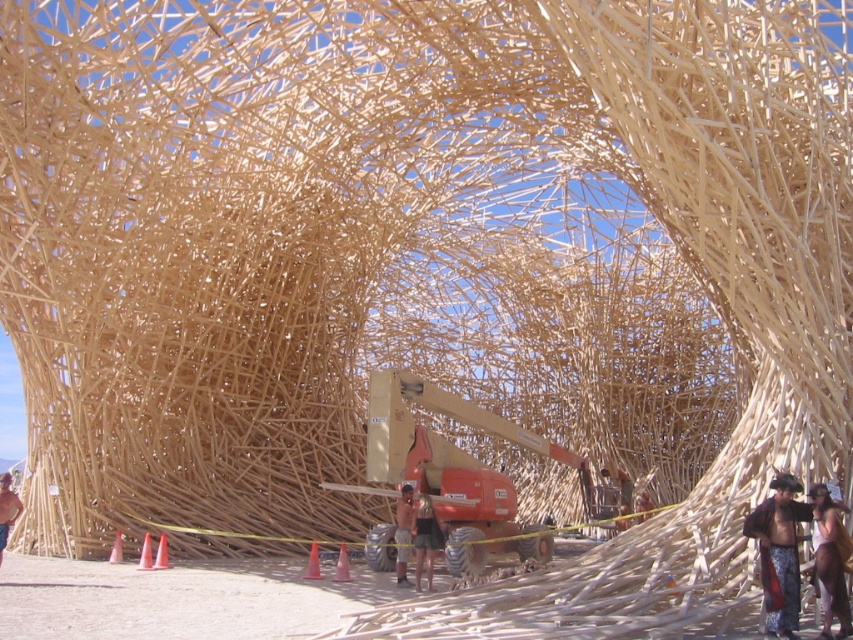
Question: Does pink plastic cone at lower center have a lesser width compared to orange plastic cone at lower center?

Choices:
 (A) no
 (B) yes

Answer: (A)

Question: Which point is farther to the camera?

Choices:
 (A) (790, 561)
 (B) (165, 556)
 (C) (405, 541)

Answer: (C)

Question: Which of these objects is positioned farthest from the orange cone at lower left?

Choices:
 (A) skinny man at center
 (B) pink plastic cone at lower center
 (C) leather vest at center
 (D) orange plastic cone at lower center

Answer: (C)

Question: Which is farther from the tan woven fabric at lower left?

Choices:
 (A) orange plastic cone at lower center
 (B) pink plastic cone at lower center
 (C) skinny man at center

Answer: (C)

Question: Does black fabric shorts at center appear on the left side of pink plastic cone at lower center?

Choices:
 (A) yes
 (B) no

Answer: (B)

Question: Does tan woven fabric at lower left have a larger size compared to orange cone at lower center?

Choices:
 (A) yes
 (B) no

Answer: (A)